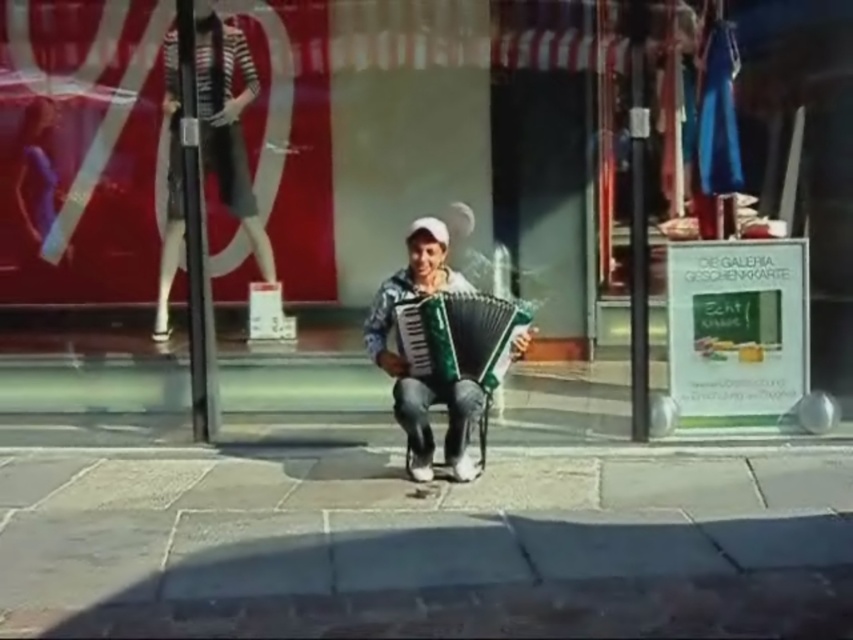
You are a street performer who just arrived at the location and see the gray stone pavement at center and the green plastic accordion at center. Which object is located to the left of the other?

The gray stone pavement at center is positioned on the left side of green plastic accordion at center.

You are a delivery person who needs to place a package on the green plastic sign at center. The package is 5 meters long. Will the package fit on the sign?

The distance between the objects is 4.87 meters, so the package is longer than the space available. It won